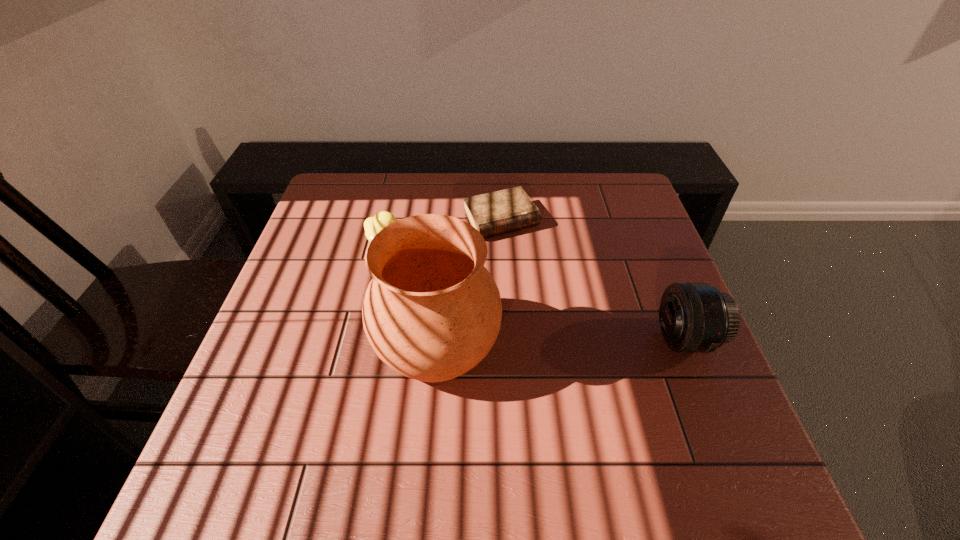
I want to click on blank space located on the beak of the second shortest object, so click(x=444, y=274).

Find the location of a particular element. Image resolution: width=960 pixels, height=540 pixels. vacant space positioned 0.220m on the beak of the second shortest object is located at coordinates (462, 284).

Where is `vacant space located on the spine side of the diary`? The height and width of the screenshot is (540, 960). vacant space located on the spine side of the diary is located at coordinates (546, 287).

Locate an element on the screen. This screenshot has height=540, width=960. vacant space located 0.320m on the spine side of the diary is located at coordinates pos(571,325).

Identify the location of vacant space situated 0.140m on the spine side of the diary. (538, 274).

Image resolution: width=960 pixels, height=540 pixels. I want to click on object located in the far edge section of the desktop, so click(x=494, y=213).

Locate an element on the screen. Image resolution: width=960 pixels, height=540 pixels. object that is at the near edge is located at coordinates (432, 312).

Where is `object situated at the right edge`? The height and width of the screenshot is (540, 960). object situated at the right edge is located at coordinates pyautogui.click(x=694, y=317).

This screenshot has height=540, width=960. In the image, there is a desktop. Find the location of `vacant space at the far edge`. vacant space at the far edge is located at coordinates [405, 187].

The width and height of the screenshot is (960, 540). In order to click on free region at the near edge of the desktop in this screenshot , I will do `click(505, 407)`.